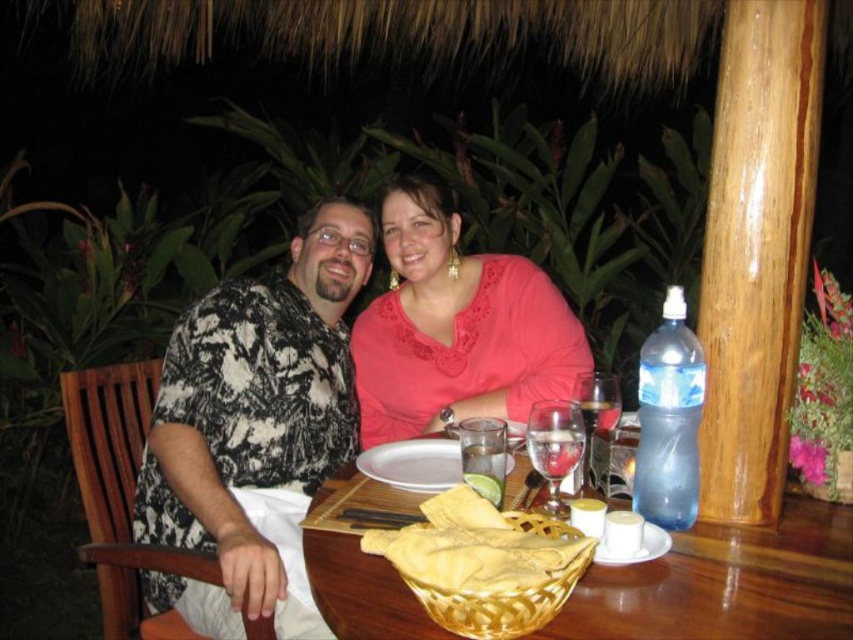
Question: Which object is closer to the camera taking this photo?

Choices:
 (A) clear glass wine glass at center
 (B) wooden table at center

Answer: (B)

Question: Can you confirm if wooden table at center is thinner than yellow wicker basket at table center?

Choices:
 (A) yes
 (B) no

Answer: (B)

Question: Which point is farther to the camera?

Choices:
 (A) (503, 417)
 (B) (421, 480)

Answer: (A)

Question: Which object is the closest to the yellow wicker basket at table center?

Choices:
 (A) clear glass wine glass at center
 (B) printed fabric shirt at left

Answer: (A)

Question: Does yellow wicker basket at table center have a larger size compared to white ceramic plate at center?

Choices:
 (A) no
 (B) yes

Answer: (A)

Question: Can you confirm if wooden table at center is wider than white ceramic plate at center?

Choices:
 (A) yes
 (B) no

Answer: (A)